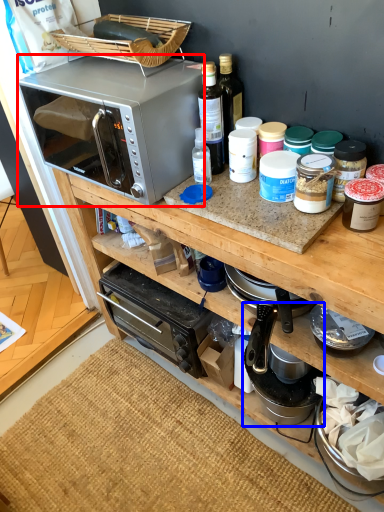
Question: Among these objects, which one is farthest to the camera, microwave oven (highlighted by a red box) or appliance (highlighted by a blue box)?

Choices:
 (A) microwave oven
 (B) appliance

Answer: (B)